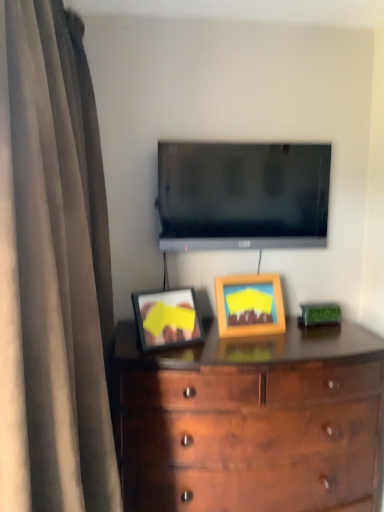
Describe the element at coordinates (249, 305) in the screenshot. I see `wooden picture frame at center` at that location.

This screenshot has height=512, width=384. What are the coordinates of `wooden picture frame at center` in the screenshot? It's located at (249, 305).

Locate an element on the screen. Image resolution: width=384 pixels, height=512 pixels. brown fabric curtain at left is located at coordinates (52, 270).

Is brown fabric curtain at left not inside wooden picture frame at center?

Yes, brown fabric curtain at left is located beyond the bounds of wooden picture frame at center.

Which object is more forward, brown fabric curtain at left or wooden picture frame at center?

brown fabric curtain at left is more forward.

Considering the relative sizes of brown fabric curtain at left and wooden picture frame at center in the image provided, is brown fabric curtain at left wider than wooden picture frame at center?

Yes.

Which object is positioned more to the right, brown fabric curtain at left or wooden picture frame at center?

wooden picture frame at center.

Is wooden chest of drawers at center facing away from brown fabric curtain at left?

No, wooden chest of drawers at center is not facing the opposite direction of brown fabric curtain at left.

Does point (148, 412) come closer to viewer compared to point (5, 255)?

No.

From a real-world perspective, between wooden chest of drawers at center and brown fabric curtain at left, who is vertically higher?

In real-world perspective, brown fabric curtain at left is above.

Which is in front, wooden chest of drawers at center or brown fabric curtain at left?

brown fabric curtain at left.

From the picture: Is wooden chest of drawers at center not near flat screen tv at upper center?

wooden chest of drawers at center is near flat screen tv at upper center, not far away.

From the image's perspective, between wooden chest of drawers at center and flat screen tv at upper center, which one is located above?

flat screen tv at upper center, from the image's perspective.

How far apart are wooden chest of drawers at center and flat screen tv at upper center?

wooden chest of drawers at center is 28.59 inches away from flat screen tv at upper center.

Is wooden chest of drawers at center spatially inside flat screen tv at upper center, or outside of it?

wooden chest of drawers at center is not enclosed by flat screen tv at upper center.

From the image's perspective, is wooden picture frame at center beneath brown fabric curtain at left?

No, from the image's perspective, wooden picture frame at center is not beneath brown fabric curtain at left.

Which of these two, wooden picture frame at center or brown fabric curtain at left, stands taller?

brown fabric curtain at left is taller.

Considering the relative positions of wooden picture frame at center and brown fabric curtain at left in the image provided, is wooden picture frame at center to the right of brown fabric curtain at left from the viewer's perspective?

Yes, wooden picture frame at center is to the right of brown fabric curtain at left.

From a real-world perspective, which is physically above, wooden picture frame at center or brown fabric curtain at left?

In real-world perspective, brown fabric curtain at left is above.

Who is shorter, brown fabric curtain at left or wooden chest of drawers at center?

With less height is wooden chest of drawers at center.

Does brown fabric curtain at left contain wooden chest of drawers at center?

No.

From a real-world perspective, who is located higher, brown fabric curtain at left or wooden chest of drawers at center?

From a 3D spatial view, brown fabric curtain at left is above.

From the image's perspective, who appears lower, brown fabric curtain at left or wooden chest of drawers at center?

wooden chest of drawers at center, from the image's perspective.

Can you see wooden picture frame at center touching flat screen tv at upper center?

They are not placed beside each other.

Is wooden picture frame at center positioned beyond the bounds of flat screen tv at upper center?

That's correct, wooden picture frame at center is outside of flat screen tv at upper center.

Can you tell me how much wooden picture frame at center and flat screen tv at upper center differ in facing direction?

The angle between the facing direction of wooden picture frame at center and the facing direction of flat screen tv at upper center is 9.76 degrees.

Relative to wooden picture frame at center, is wooden chest of drawers at center in front or behind?

wooden chest of drawers at center is in front of wooden picture frame at center.

Which is closer, (227, 392) or (235, 328)?

Point (227, 392) is positioned closer to the camera compared to point (235, 328).

Measure the distance between wooden chest of drawers at center and wooden picture frame at center.

32.78 centimeters.

Is wooden chest of drawers at center beside wooden picture frame at center?

wooden chest of drawers at center and wooden picture frame at center are clearly separated.

This screenshot has height=512, width=384. I want to click on picture frame behind the brown fabric curtain at left, so coord(249,305).

The image size is (384, 512). Identify the location of curtain on the left of wooden chest of drawers at center. (52, 270).

Considering their positions, is wooden chest of drawers at center positioned further to flat screen tv at upper center than wooden picture frame at center?

Based on the image, wooden chest of drawers at center appears to be further to flat screen tv at upper center.

Looking at this image, which object lies nearer to the anchor point flat screen tv at upper center, wooden picture frame at center or wooden chest of drawers at center?

wooden picture frame at center.

Considering their positions, is wooden picture frame at center positioned closer to wooden chest of drawers at center than flat screen tv at upper center?

Among the two, wooden picture frame at center is located nearer to wooden chest of drawers at center.

Based on their spatial positions, is brown fabric curtain at left or flat screen tv at upper center further from wooden picture frame at center?

Based on the image, brown fabric curtain at left appears to be further to wooden picture frame at center.

Considering their positions, is wooden chest of drawers at center positioned further to wooden picture frame at center than brown fabric curtain at left?

brown fabric curtain at left is positioned further to the anchor wooden picture frame at center.

When comparing their distances from wooden picture frame at center, does flat screen tv at upper center or brown fabric curtain at left seem closer?

flat screen tv at upper center is closer to wooden picture frame at center.

From the image, which object appears to be nearer to flat screen tv at upper center, wooden chest of drawers at center or brown fabric curtain at left?

Among the two, wooden chest of drawers at center is located nearer to flat screen tv at upper center.

Estimate the real-world distances between objects in this image. Which object is further from flat screen tv at upper center, wooden picture frame at center or brown fabric curtain at left?

brown fabric curtain at left is positioned further to the anchor flat screen tv at upper center.

Locate an element on the screen. the chest of drawers positioned between brown fabric curtain at left and flat screen tv at upper center from near to far is located at coordinates (252, 421).

Where is `chest of drawers between brown fabric curtain at left and wooden picture frame at center from front to back`? This screenshot has width=384, height=512. chest of drawers between brown fabric curtain at left and wooden picture frame at center from front to back is located at coordinates (252, 421).

Find the location of `picture frame between flat screen tv at upper center and wooden chest of drawers at center in the up-down direction`. picture frame between flat screen tv at upper center and wooden chest of drawers at center in the up-down direction is located at coordinates (249, 305).

The width and height of the screenshot is (384, 512). I want to click on picture frame positioned between brown fabric curtain at left and flat screen tv at upper center from near to far, so click(249, 305).